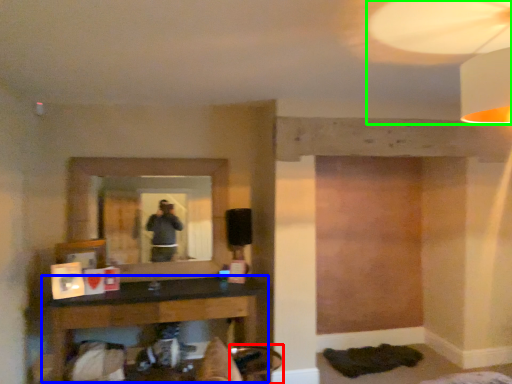
Question: Estimate the real-world distances between objects in this image. Which object is closer to swivel chair (highlighted by a red box), table (highlighted by a blue box) or mechanical fan (highlighted by a green box)?

Choices:
 (A) table
 (B) mechanical fan

Answer: (A)